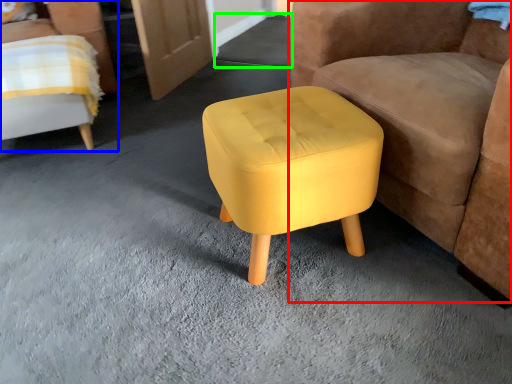
Question: Based on their relative distances, which object is farther from chair (highlighted by a red box)? Choose from chair (highlighted by a blue box) and concrete (highlighted by a green box).

Choices:
 (A) chair
 (B) concrete

Answer: (B)